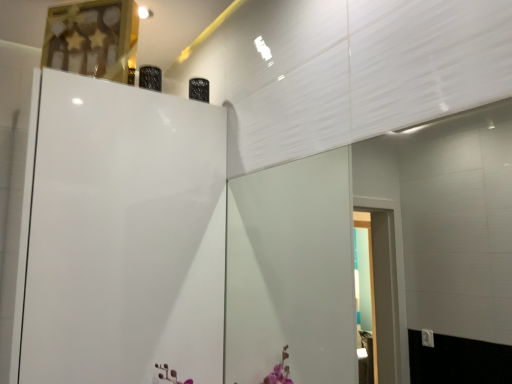
The height and width of the screenshot is (384, 512). What are the coordinates of `white glossy door at upper left` in the screenshot? It's located at (124, 236).

Describe the element at coordinates (124, 236) in the screenshot. I see `white glossy door at upper left` at that location.

Find the location of a particular element. white glossy door at upper left is located at coordinates (124, 236).